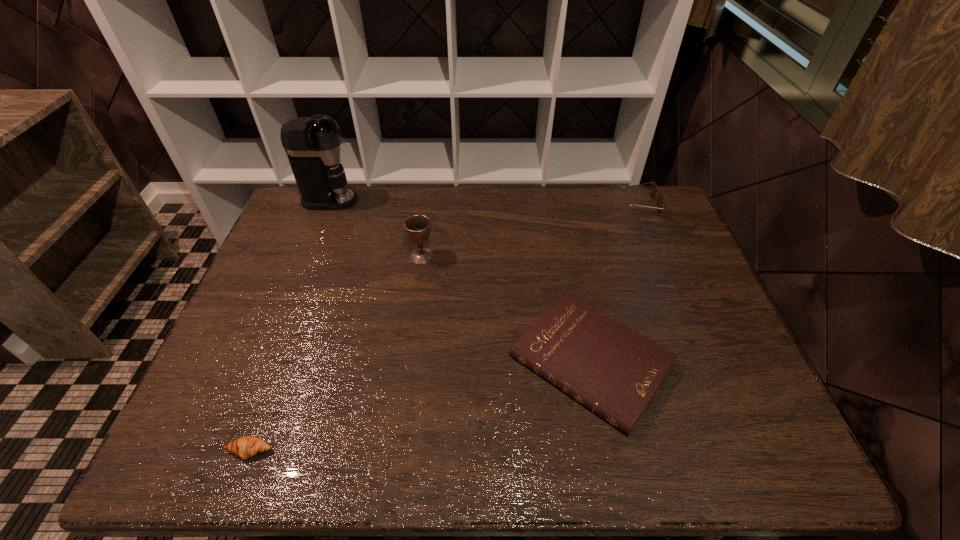
You are a GUI agent. You are given a task and a screenshot of the screen. Output one action in this format:
    pyautogui.click(x=<x>, y=<y>)
    Task: Click on the free spot between the tallest object and the chalice
    
    Given the screenshot: What is the action you would take?
    pyautogui.click(x=375, y=228)

This screenshot has width=960, height=540. Find the location of `vacant space that's between the third farthest object and the hardback book`. vacant space that's between the third farthest object and the hardback book is located at coordinates (506, 308).

At what (x,y) coordinates should I click in order to perform the action: click on vacant space that's between the tallest object and the nearest object. Please return your answer as a coordinate pair (x, y). Looking at the image, I should click on (290, 326).

I want to click on free spot between the coffee maker and the fourth shortest object, so click(375, 228).

In order to click on blank region between the spectacles and the coffee maker in this screenshot , I will do `click(485, 202)`.

You are a GUI agent. You are given a task and a screenshot of the screen. Output one action in this format:
    pyautogui.click(x=<x>, y=<y>)
    Task: Click on the free space that is in between the fourth object from left to right and the rightmost object
    Image resolution: width=960 pixels, height=540 pixels.
    Given the screenshot: What is the action you would take?
    pyautogui.click(x=615, y=282)

The height and width of the screenshot is (540, 960). In order to click on vacant area that lies between the chalice and the nearest object in this screenshot , I will do `click(336, 353)`.

You are a GUI agent. You are given a task and a screenshot of the screen. Output one action in this format:
    pyautogui.click(x=<x>, y=<y>)
    Task: Click on the object that is the third closest to the tallest object
    The image size is (960, 540).
    Given the screenshot: What is the action you would take?
    pyautogui.click(x=245, y=447)

Choose which object is the third nearest neighbor to the hardback book. Please provide its 2D coordinates. Your answer should be formatted as a tuple, i.e. [(x, y)], where the tuple contains the x and y coordinates of a point satisfying the conditions above.

[(245, 447)]

Find the location of a particular element. Image resolution: width=960 pixels, height=540 pixels. free point that satisfies the following two spatial constraints: 1. place cup under the spout of the third nearest object; 2. on the left side of the tallest object is located at coordinates (307, 256).